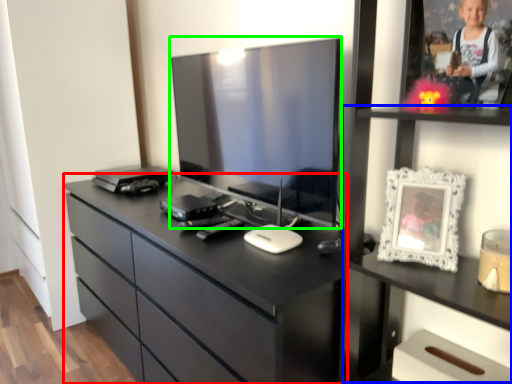
Question: Estimate the real-world distances between objects in this image. Which object is farther from chest of drawers (highlighted by a red box), tv cabinet (highlighted by a blue box) or television (highlighted by a green box)?

Choices:
 (A) tv cabinet
 (B) television

Answer: (A)